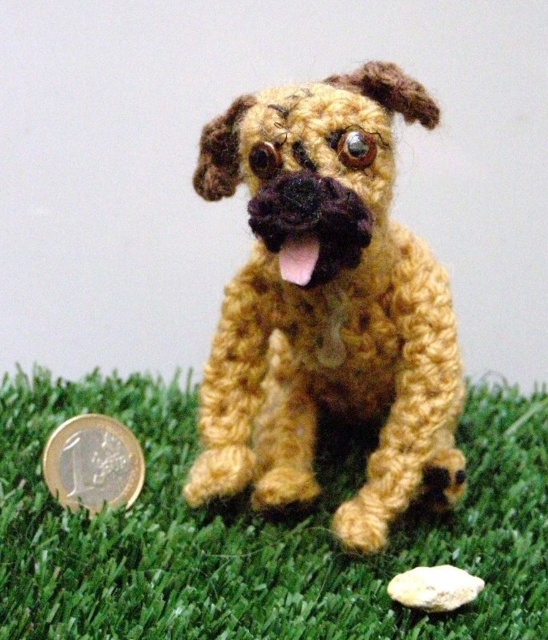
Question: Which point appears closest to the camera in this image?

Choices:
 (A) (93, 449)
 (B) (4, 614)

Answer: (B)

Question: Considering the relative positions of yarn crocheted dog at center and gold metallic coin at lower left in the image provided, where is yarn crocheted dog at center located with respect to gold metallic coin at lower left?

Choices:
 (A) below
 (B) above

Answer: (B)

Question: Is the position of yarn crocheted dog at center more distant than that of gold metallic coin at lower left?

Choices:
 (A) no
 (B) yes

Answer: (A)

Question: Among these points, which one is farthest from the camera?

Choices:
 (A) (475, 544)
 (B) (264, 211)

Answer: (A)

Question: Which point appears farthest from the camera in this image?

Choices:
 (A) (501, 550)
 (B) (119, 499)

Answer: (B)

Question: Is the position of yarn crocheted dog at center more distant than that of gold metallic coin at lower left?

Choices:
 (A) no
 (B) yes

Answer: (A)